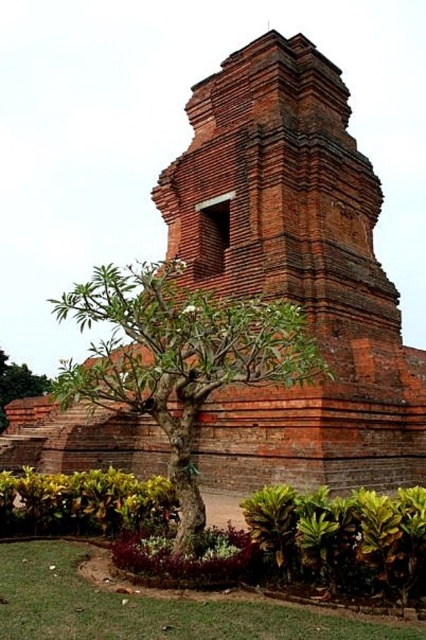
In the scene shown: You are standing in front of the historical brick structure and want to plant a new tree. The recommended planting location is at point (83, 502). Is there already an object at this location?

Yes, there is a green leafy shrub at lower left located at point (83, 502), so the location is already occupied.

You are an archaeologist examining the historical brick structure. You notice two green leafy plants at the lower left of the scene. Which one is closer to you, the green leafy shrub at lower left or the green leafy tree at lower left?

The green leafy shrub at lower left is closer to you because it is in front of the green leafy tree at lower left.

You are a gardener planning to water both the green leafy shrub at lower right and the green leafy shrub at lower left. The water source is located at the base of the historical brick structure. Which shrub is closer to the water source?

The green leafy shrub at lower left is closer to the water source because the shrub at lower right is 13.40 meters away from it, implying the left shrub is nearer to the central structure where the water source is located.